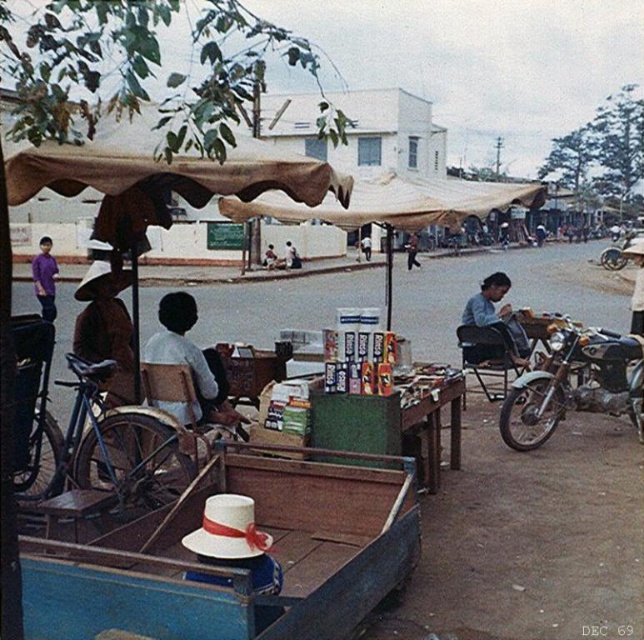
Question: Can you confirm if light blue shirt at center is smaller than blue denim shirt at center?

Choices:
 (A) no
 (B) yes

Answer: (B)

Question: Which object appears farthest from the camera in this image?

Choices:
 (A) light blue shirt at center
 (B) blue matte bicycle at left
 (C) white matte hat at lower left
 (D) shiny chrome motorcycle at right

Answer: (D)

Question: Is white matte hat at lower left bigger than purple cotton shirt at left?

Choices:
 (A) no
 (B) yes

Answer: (A)

Question: Which of these objects is positioned closest to the purple cotton shirt at left?

Choices:
 (A) blue matte bicycle at left
 (B) blue denim shirt at center
 (C) white matte hat at lower left
 (D) shiny chrome motorcycle at right

Answer: (A)

Question: Can you confirm if shiny chrome motorcycle at right is wider than purple cotton shirt at left?

Choices:
 (A) yes
 (B) no

Answer: (B)

Question: Which point is farther from the camera taking this photo?

Choices:
 (A) (520, 324)
 (B) (408, 248)
 (C) (161, 490)
 (D) (305, 595)

Answer: (B)